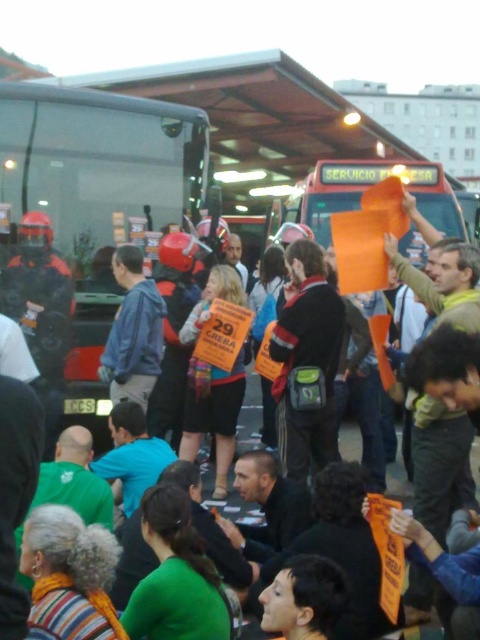
You are a photographer trying to capture a clear shot of the dark gray fabric jacket at center without the transparent glass bus at left obstructing the view. Is it possible to adjust your position to achieve this?

The transparent glass bus at left is positioned over dark gray fabric jacket at center, meaning the bus is directly in front of the jacket. However, since the bus is made of transparent glass, you can still see the jacket through the bus. Therefore, you can adjust your angle slightly to ensure the jacket is clearly visible without the bus blocking the view.

You are a photographer standing at the scene. You want to take a photo of the transparent glass bus at left without including any protesters in the frame. Given that the protesters are 10 feet away from you, is it possible to do so?

The transparent glass bus at left is 24.74 feet away from you. Since the protesters are only 10 feet away, you can step back to ensure the bus is in frame while excluding the closer protesters.

You are a photographer trying to capture a clear photo of the dark gray fabric jacket at center without the transparent glass bus at left obstructing the view. Is it possible to position yourself so that the bus doesn not block the jacket?

The transparent glass bus at left is larger in size than the dark gray fabric jacket at center, but since the bus is transparent, you can position yourself where the bus is between you and the jacket but still see through the bus to capture the jacket as long as the bus windows are clear.